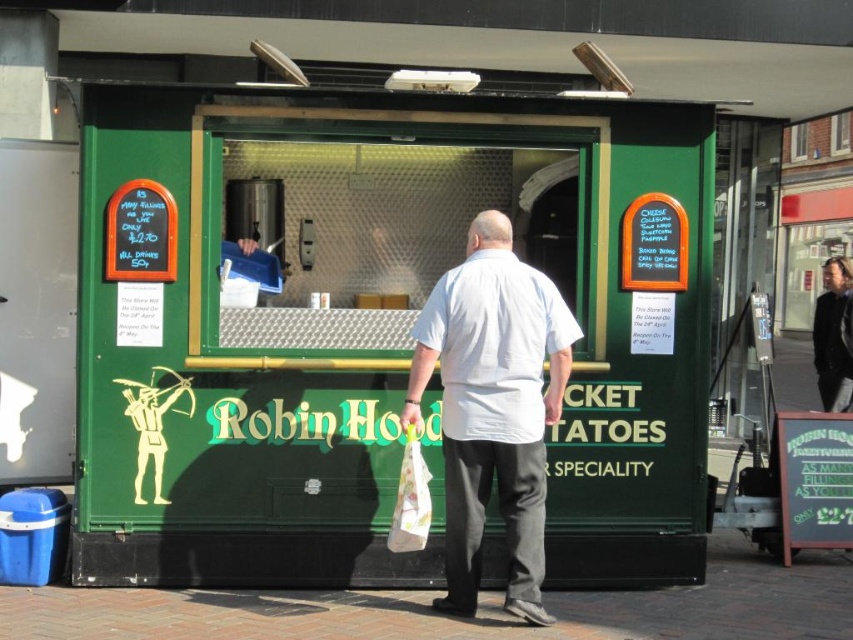
You are a delivery person with a white fabric bag at lower center that is 1.5 feet wide. You need to place it on the green matte food truck at center. Is there enough space on the truck to fit the bag without moving anything else?

The green matte food truck at center is 3.66 feet away from the white fabric bag at lower center. The distance between them does not indicate the truck has enough space to fit the bag. Please check the truck dimensions.

Consider the image. You are a customer at the Robin Hood food kiosk. You notice two items inside the kiosk window. The first is a white cotton shirt at center, and the second is a white fabric bag at lower center. Which item is taller?

The white cotton shirt at center is much taller than the white fabric bag at lower center.

Based on the photo, you are a customer standing in front of the Robin Hood themed food kiosk. You notice the green matte food truck at center and the white cotton shirt at center. Which object is positioned higher from the ground?

The green matte food truck at center is located above the white cotton shirt at center, so it is positioned higher from the ground.